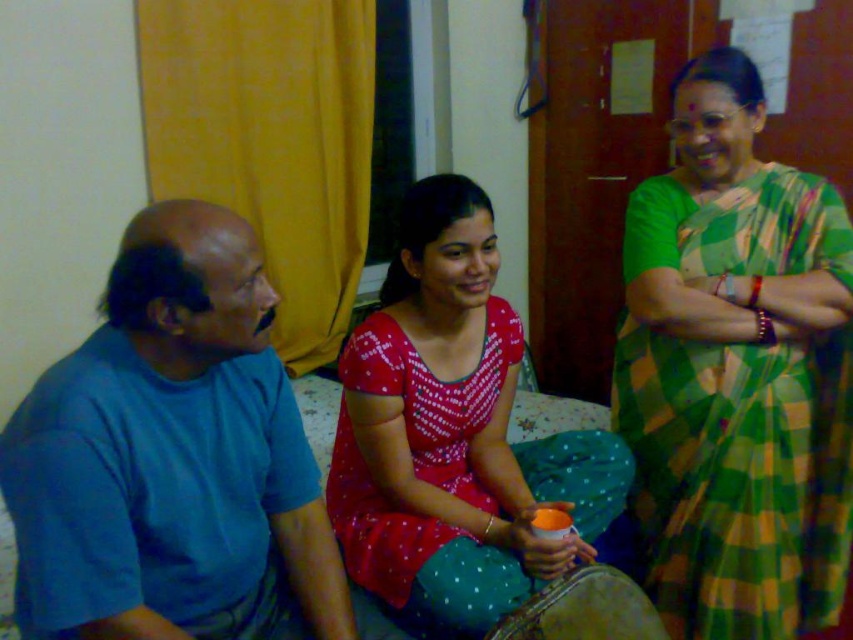
Can you confirm if green checkered saree at right is positioned to the left of blue cotton shirt at left?

No, green checkered saree at right is not to the left of blue cotton shirt at left.

Is point (672, 86) in front of point (148, 625)?

No, it is behind (148, 625).

Locate an element on the screen. The image size is (853, 640). green checkered saree at right is located at coordinates (737, 372).

I want to click on green checkered saree at right, so pyautogui.click(x=737, y=372).

Is green checkered saree at right bigger than matte red blouse at center?

No.

Is green checkered saree at right smaller than matte red blouse at center?

Correct, green checkered saree at right occupies less space than matte red blouse at center.

The image size is (853, 640). What do you see at coordinates (737, 372) in the screenshot?
I see `green checkered saree at right` at bounding box center [737, 372].

In order to click on green checkered saree at right in this screenshot , I will do `click(737, 372)`.

From the picture: Does blue cotton shirt at left come in front of matte red blouse at center?

Yes, it is.

Is point (45, 452) closer to camera compared to point (410, 353)?

Yes.

Is point (50, 490) closer to viewer compared to point (444, 560)?

That is True.

The width and height of the screenshot is (853, 640). I want to click on blue cotton shirt at left, so click(170, 454).